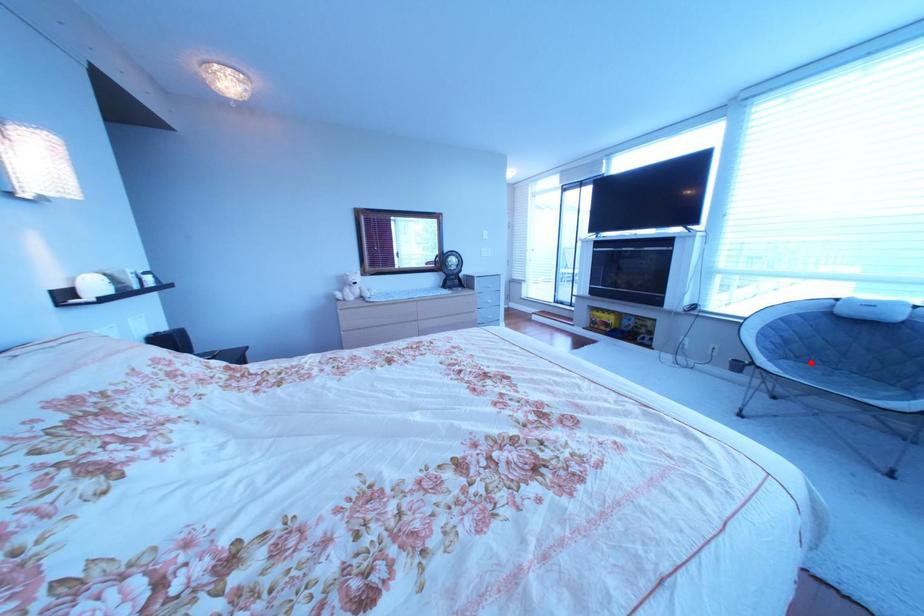
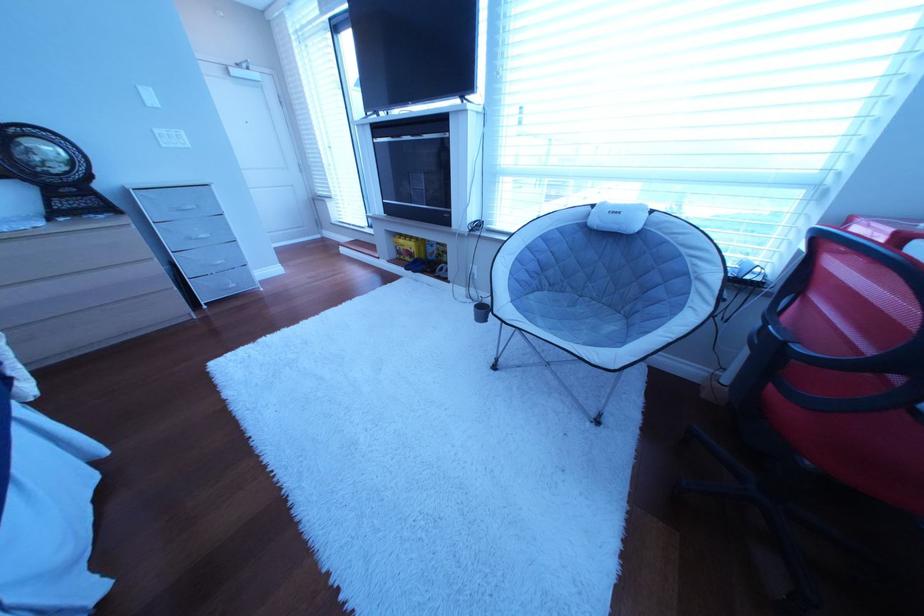
Locate, in the second image, the point that corresponds to the highlighted location in the first image.

(565, 293)